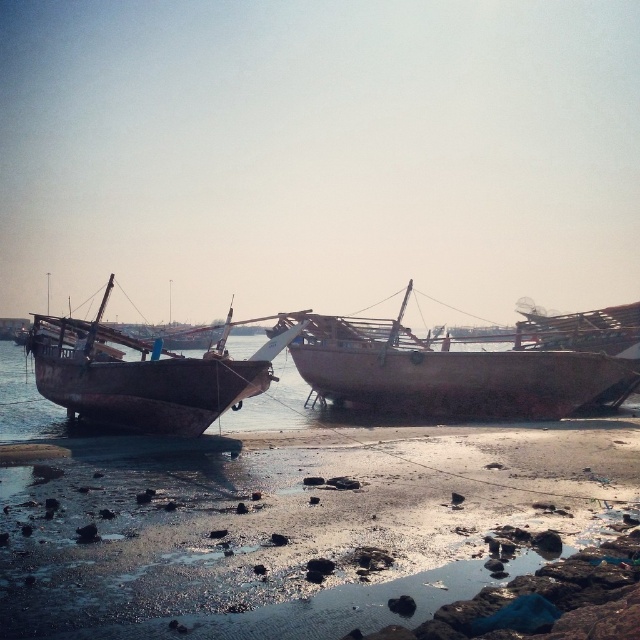
Who is lower down, rusty wood boat at center or rusty wooden boat at left?

rusty wood boat at center is lower down.

Who is shorter, rusty wood boat at center or rusty wooden boat at left?

rusty wooden boat at left

Which is in front, point (564, 349) or point (113, 353)?

Positioned in front is point (113, 353).

Identify the location of rusty wood boat at center. This screenshot has width=640, height=640. (452, 372).